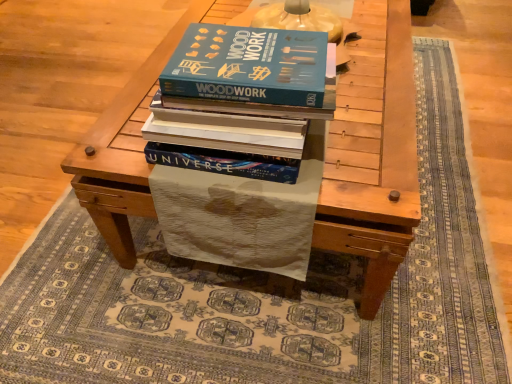
At what (x,y) coordinates should I click in order to perform the action: click on vacant area on top of blue hardcover book at center (from a real-world perspective). Please return your answer as a coordinate pair (x, y). Image resolution: width=512 pixels, height=384 pixels. Looking at the image, I should click on (243, 55).